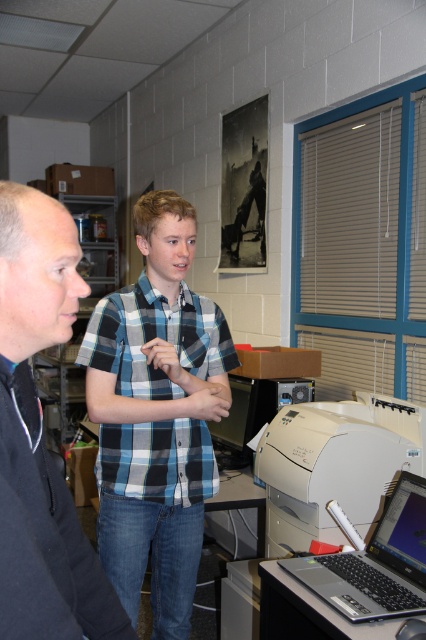
This screenshot has height=640, width=426. Describe the element at coordinates (334, 465) in the screenshot. I see `white matte printer at lower right` at that location.

Who is more forward, (x=340, y=433) or (x=399, y=508)?

Positioned in front is point (x=399, y=508).

At what (x,y) coordinates should I click in order to perform the action: click on white matte printer at lower right. Please return your answer as a coordinate pair (x, y). Looking at the image, I should click on (334, 465).

Does dark blue sweater at left have a smaller size compared to satin silver laptop at lower right?

Incorrect, dark blue sweater at left is not smaller in size than satin silver laptop at lower right.

Who is higher up, dark blue sweater at left or satin silver laptop at lower right?

dark blue sweater at left is higher up.

Between point (66, 497) and point (423, 497), which one is positioned behind?

The point (423, 497) is more distant.

The image size is (426, 640). Find the location of `dark blue sweater at left`. dark blue sweater at left is located at coordinates (40, 436).

Does white matte printer at lower right lie in front of black plastic printer at center?

Yes.

Consider the image. Measure the distance from white matte printer at lower right to black plastic printer at center.

white matte printer at lower right and black plastic printer at center are 23.13 inches apart from each other.

Locate an element on the screen. white matte printer at lower right is located at coordinates (334, 465).